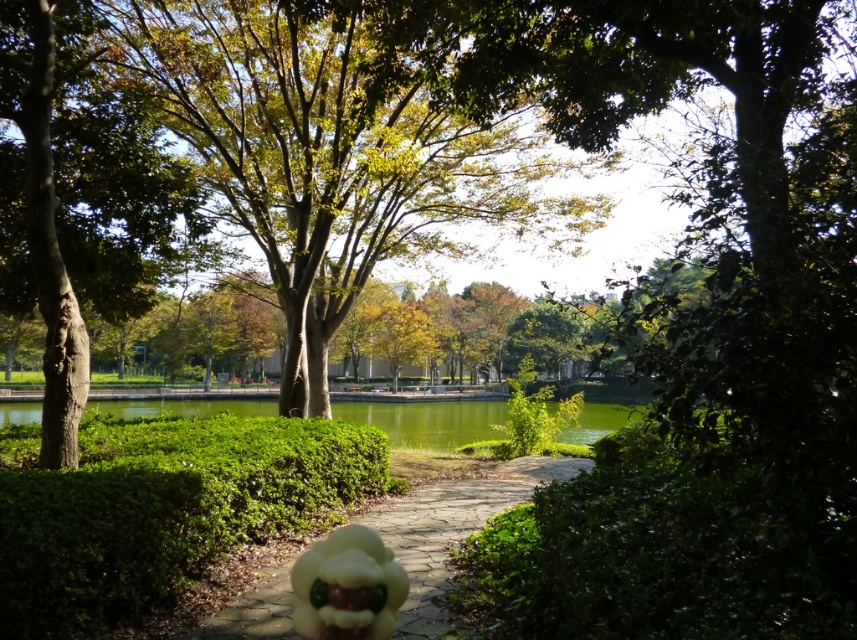
Question: Can you confirm if yellow rubber duck at center is positioned to the right of yellow matte plush at center?

Choices:
 (A) yes
 (B) no

Answer: (B)

Question: Among these objects, which one is nearest to the camera?

Choices:
 (A) green leafy hedge at center
 (B) green matte tree at left

Answer: (A)

Question: Considering the relative positions of green leafy hedge at center and green matte tree at left in the image provided, where is green leafy hedge at center located with respect to green matte tree at left?

Choices:
 (A) left
 (B) right

Answer: (B)

Question: Which object is positioned farthest from the green leafy hedge at center?

Choices:
 (A) green matte tree at left
 (B) yellow matte plush at center

Answer: (B)

Question: Among these points, which one is nearest to the camera?

Choices:
 (A) (361, 547)
 (B) (349, 241)
 (C) (476, 520)

Answer: (A)

Question: Does green leafy tree at center come behind yellow rubber duck at center?

Choices:
 (A) yes
 (B) no

Answer: (A)